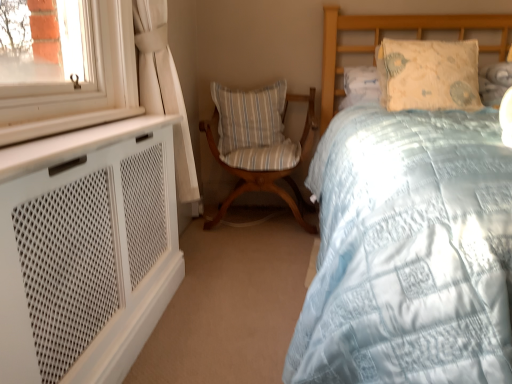
Question: Are striped fabric pillow at center, the 1th pillow in the back-to-front sequence, and light blue quilted bed at center far apart?

Choices:
 (A) no
 (B) yes

Answer: (B)

Question: Is striped fabric pillow at center, the 2th pillow when ordered from right to left, smaller than light blue quilted bed at center?

Choices:
 (A) yes
 (B) no

Answer: (A)

Question: Is striped fabric pillow at center, the 1th pillow in the back-to-front sequence, at the left side of light blue quilted bed at center?

Choices:
 (A) no
 (B) yes

Answer: (B)

Question: Is striped fabric pillow at center, the 1th pillow when ordered from left to right, looking in the opposite direction of light blue quilted bed at center?

Choices:
 (A) no
 (B) yes

Answer: (A)

Question: Is striped fabric pillow at center, the 2th pillow when ordered from right to left, taller than light blue quilted bed at center?

Choices:
 (A) no
 (B) yes

Answer: (A)

Question: Is light blue quilted bed at center to the left or to the right of woodenchair at center in the image?

Choices:
 (A) right
 (B) left

Answer: (A)

Question: Considering the positions of light blue quilted bed at center and woodenchair at center in the image, is light blue quilted bed at center bigger or smaller than woodenchair at center?

Choices:
 (A) small
 (B) big

Answer: (B)

Question: In terms of height, does light blue quilted bed at center look taller or shorter compared to woodenchair at center?

Choices:
 (A) short
 (B) tall

Answer: (B)

Question: From a real-world perspective, is light blue quilted bed at center above or below woodenchair at center?

Choices:
 (A) below
 (B) above

Answer: (B)

Question: From the image's perspective, is woodenchair at center positioned above or below light blue quilted bed at center?

Choices:
 (A) below
 (B) above

Answer: (B)

Question: In the image, is woodenchair at center on the left side or the right side of light blue quilted bed at center?

Choices:
 (A) right
 (B) left

Answer: (B)

Question: Considering their positions, is woodenchair at center located in front of or behind light blue quilted bed at center?

Choices:
 (A) front
 (B) behind

Answer: (B)

Question: Do you think woodenchair at center is within light blue quilted bed at center, or outside of it?

Choices:
 (A) outside
 (B) inside

Answer: (A)

Question: Is striped fabric pillow at center, the 1th pillow in the back-to-front sequence, in front of or behind woodenchair at center in the image?

Choices:
 (A) behind
 (B) front

Answer: (A)

Question: From the image's perspective, is striped fabric pillow at center, which is the 2th pillow in front-to-back order, located above or below woodenchair at center?

Choices:
 (A) above
 (B) below

Answer: (A)